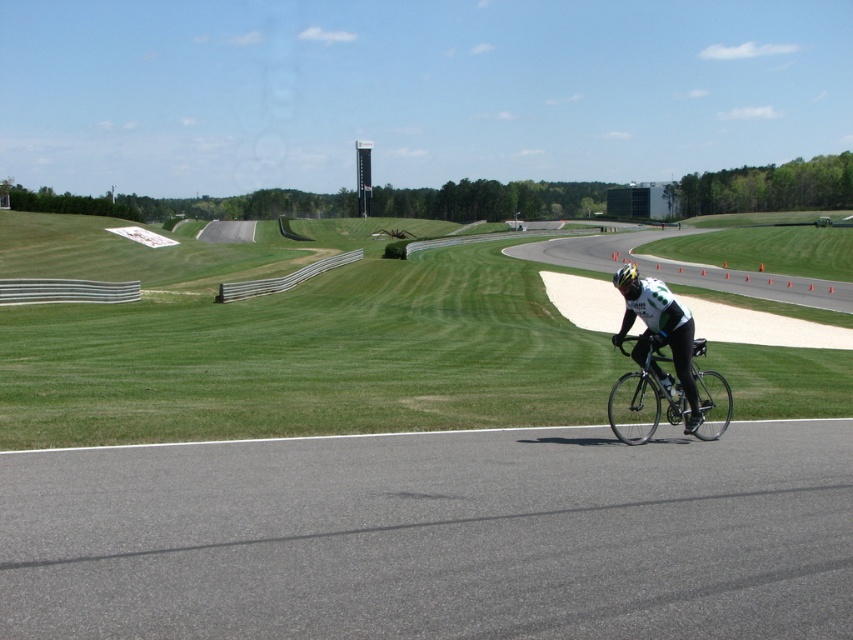
You are a photographer positioned at the edge of the gray asphalt road at center. You want to capture a photo of the shiny silver bicycle at center as it moves along the road. Based on their sizes in the image, which object takes up more area in the photo?

The shiny silver bicycle at center takes up more area in the photo than the gray asphalt road at center because the gray asphalt road at center occupies less space than the shiny silver bicycle at center.

You are a drone operator trying to capture aerial footage of the gray asphalt road at center and the green grass at center. Which object will appear taller in the footage?

The green grass at center is taller than the gray asphalt road at center, so it will appear taller in the footage.

You are standing at the starting line of the race track and see the point marked at coordinates point (686, 516). If you want to reach that point quickly, which direction should you move in relation to the cyclist currently on the road?

The point marked at coordinates point (686, 516) is 7.04 meters away from the viewer. Since the cyclist is on the road, moving towards the point would require heading in the direction of the road curve visible in the background, which is the path leading towards the point.